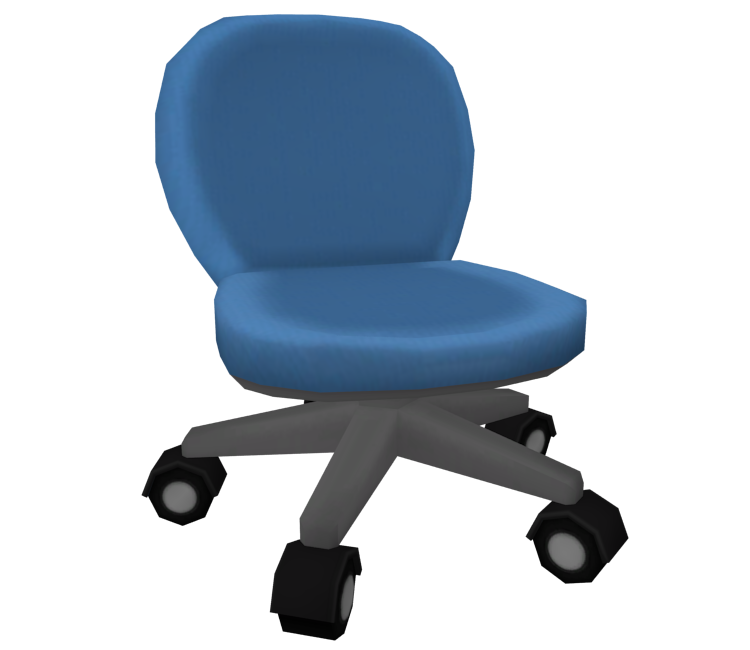
Where is `dark blue section of seat`? The height and width of the screenshot is (650, 750). dark blue section of seat is located at coordinates click(x=430, y=304), click(x=384, y=306).